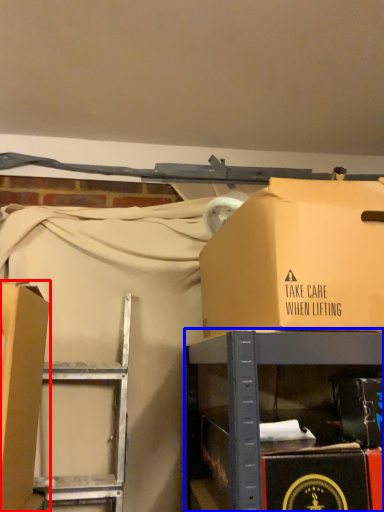
Question: Which object is further to the camera taking this photo, box (highlighted by a red box) or furniture (highlighted by a blue box)?

Choices:
 (A) box
 (B) furniture

Answer: (A)